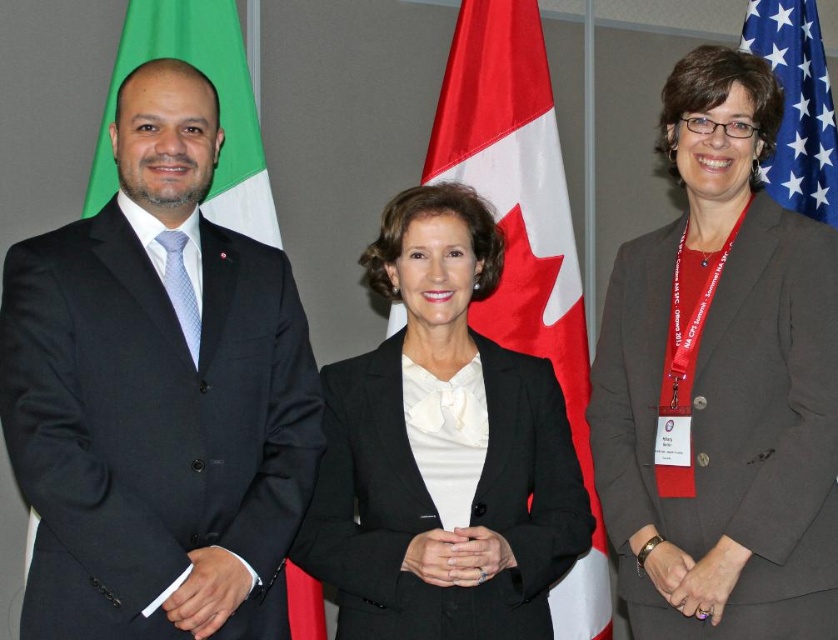
Question: Can you confirm if black suit at left is positioned to the left of red/white fabric flag at center?

Choices:
 (A) no
 (B) yes

Answer: (B)

Question: Can you confirm if black suit at left is positioned below black matte suit at center?

Choices:
 (A) yes
 (B) no

Answer: (B)

Question: Which of the following is the closest to the observer?

Choices:
 (A) blue fabric flag at upper right
 (B) red/white fabric flag at center
 (C) black matte suit at center

Answer: (C)

Question: Is black suit at left positioned in front of black matte suit at center?

Choices:
 (A) yes
 (B) no

Answer: (A)

Question: Which point is farther to the camera?

Choices:
 (A) (449, 131)
 (B) (661, 369)
 (C) (541, 515)
 (D) (836, 172)

Answer: (D)

Question: Which of the following is the closest to the observer?

Choices:
 (A) red/white fabric flag at center
 (B) blue fabric flag at upper right
 (C) black matte suit at center

Answer: (C)